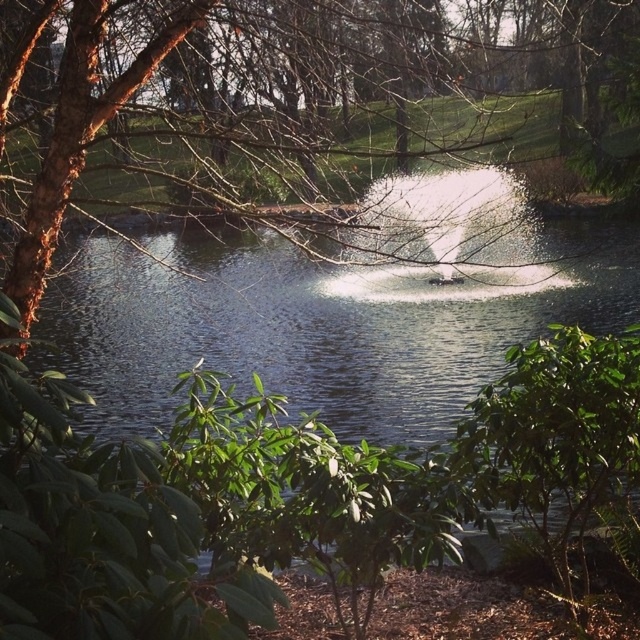
You are standing in the serene natural scene with the pond and dense foliage. You notice a point marked at coordinates (268, 128). What object in the scene does this point correspond to?

The point at coordinates (268, 128) corresponds to the brown rough bark tree at upper left.

You are standing in front of the pond and want to compare the widths of the brown rough bark tree at upper left and the clear water at center. Which one is wider?

The clear water at center is wider than the brown rough bark tree at upper left.

You are a small drone that is 1 foot wide. You are flying over a serene pond scene and need to navigate between the brown rough bark tree at upper left and the clear water at center. Can you safely pass through the space between them without hitting either object?

The distance between the brown rough bark tree at upper left and the clear water at center is 4.39 feet. Since the drone is 1 foot wide, there is sufficient space for it to pass safely between them.